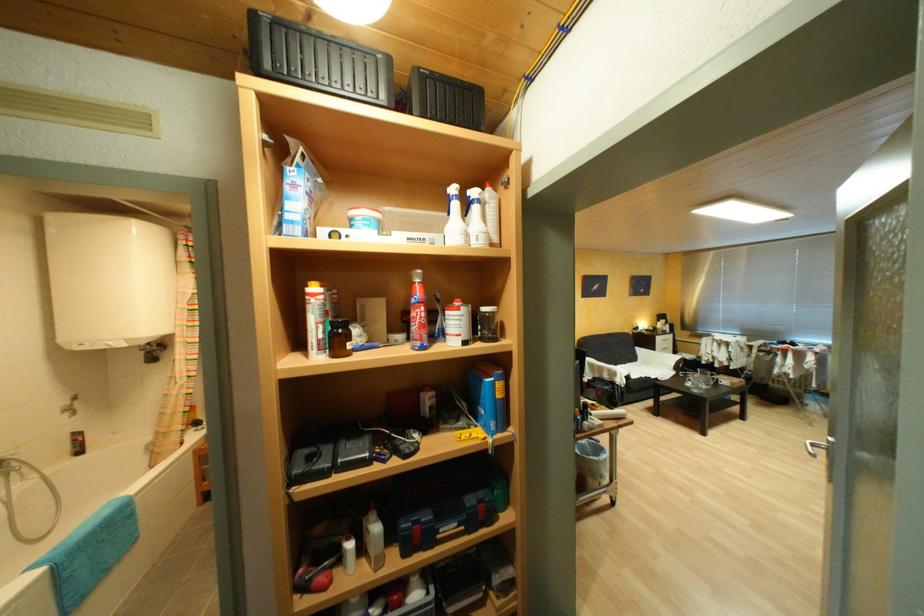
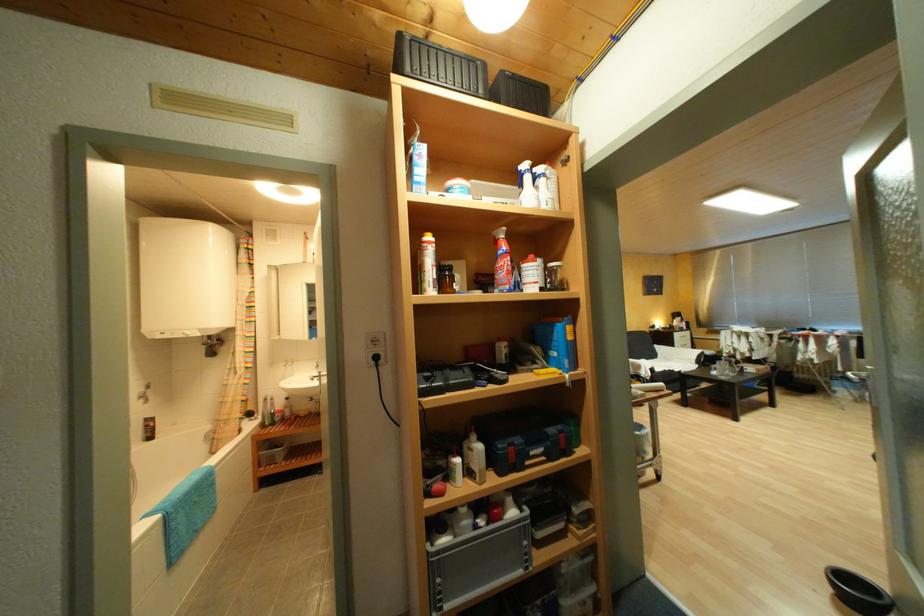
Where in the second image is the point corresponding to the point at 157,342 from the first image?

(220, 338)